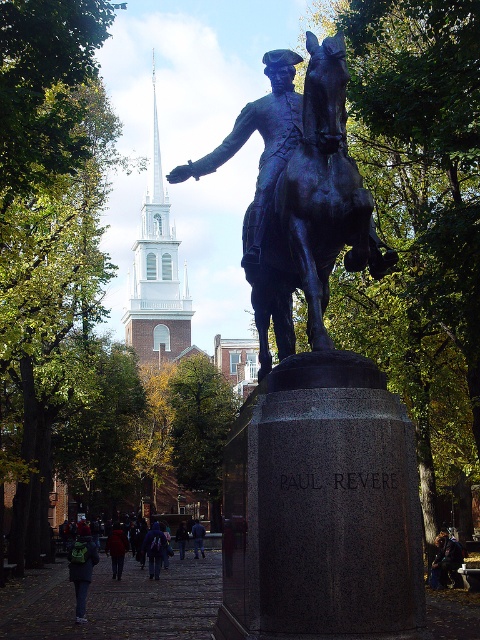
Is point (256, 548) farther from camera compared to point (183, 525)?

No, (256, 548) is in front of (183, 525).

Does bronze statue at center appear under dark blue jeans at lower center?

No.

Between point (280, 602) and point (180, 547), which one is positioned behind?

Positioned behind is point (180, 547).

This screenshot has width=480, height=640. In order to click on bronze statue at center in this screenshot , I will do `click(320, 419)`.

Which is behind, point (122, 536) or point (196, 524)?

The point (196, 524) is behind.

Can you confirm if dark brown leather jacket at lower center is positioned below blue jeans at lower center?

No.

Which is behind, point (121, 557) or point (192, 525)?

The point (192, 525) is more distant.

I want to click on dark brown leather jacket at lower center, so click(x=117, y=548).

Who is positioned more to the right, dark blue jeans at center or dark blue jeans at lower center?

dark blue jeans at lower center

Who is more distant from viewer, (68,596) or (183,557)?

The point (183,557) is more distant.

The height and width of the screenshot is (640, 480). What are the coordinates of `dark blue jeans at center` in the screenshot? It's located at (141, 602).